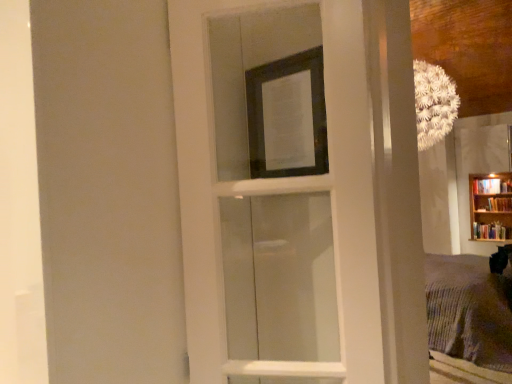
Describe the element at coordinates (490, 206) in the screenshot. I see `wooden bookcase at right` at that location.

This screenshot has width=512, height=384. I want to click on white glass door at center, so click(x=316, y=191).

Find the location of a particular element. This screenshot has height=384, width=512. transparent glass screen door at upper center is located at coordinates (108, 192).

This screenshot has width=512, height=384. I want to click on screen door that is under the matte black picture frame at upper center (from a real-world perspective), so click(108, 192).

From the image's perspective, who appears lower, transparent glass screen door at upper center or matte black picture frame at upper center?

transparent glass screen door at upper center is shown below in the image.

Based on the photo, does transparent glass screen door at upper center turn towards matte black picture frame at upper center?

No, transparent glass screen door at upper center is not facing towards matte black picture frame at upper center.

Which object is more forward, transparent glass screen door at upper center or matte black picture frame at upper center?

transparent glass screen door at upper center is closer to the camera.

At what (x,y) coordinates should I click in order to perform the action: click on door located above the wooden bookcase at right (from the image's perspective). Please return your answer as a coordinate pair (x, y). This screenshot has width=512, height=384. Looking at the image, I should click on (316, 191).

Is wooden bookcase at right facing away from white glass door at center?

Yes, wooden bookcase at right is facing away from white glass door at center.

In the scene shown: Does wooden bookcase at right touch white glass door at center?

No, wooden bookcase at right is not making contact with white glass door at center.

Is matte black picture frame at upper center taller or shorter than transparent glass screen door at upper center?

matte black picture frame at upper center is shorter than transparent glass screen door at upper center.

Based on the photo, from the image's perspective, between matte black picture frame at upper center and transparent glass screen door at upper center, who is located below?

transparent glass screen door at upper center, from the image's perspective.

Who is more distant, matte black picture frame at upper center or transparent glass screen door at upper center?

Positioned behind is matte black picture frame at upper center.

Consider the image. From a real-world perspective, which is physically above, matte black picture frame at upper center or transparent glass screen door at upper center?

matte black picture frame at upper center is physically above.

Is transparent glass screen door at upper center far from white glass door at center?

transparent glass screen door at upper center is near white glass door at center, not far away.

Measure the distance between transparent glass screen door at upper center and white glass door at center.

The distance of transparent glass screen door at upper center from white glass door at center is 30.57 centimeters.

Who is shorter, transparent glass screen door at upper center or white glass door at center?

white glass door at center is shorter.

Between point (71, 312) and point (341, 47), which one is positioned behind?

Positioned behind is point (341, 47).

Considering the relative sizes of white glass door at center and wooden bookcase at right in the image provided, is white glass door at center taller than wooden bookcase at right?

Yes.

Between point (401, 200) and point (495, 240), which one is positioned behind?

Positioned behind is point (495, 240).

Based on the photo, from a real-world perspective, is white glass door at center above or below wooden bookcase at right?

From a real-world perspective, white glass door at center is physically above wooden bookcase at right.

Who is shorter, wooden bookcase at right or transparent glass screen door at upper center?

Standing shorter between the two is wooden bookcase at right.

How many degrees apart are the facing directions of wooden bookcase at right and transparent glass screen door at upper center?

They differ by 177 degrees in their facing directions.

Is wooden bookcase at right not near transparent glass screen door at upper center?

Yes, wooden bookcase at right and transparent glass screen door at upper center are quite far apart.

From a real-world perspective, is wooden bookcase at right beneath transparent glass screen door at upper center?

Yes, from a real-world perspective, wooden bookcase at right is under transparent glass screen door at upper center.

Is transparent glass screen door at upper center shorter than wooden bookcase at right?

Incorrect, the height of transparent glass screen door at upper center does not fall short of that of wooden bookcase at right.

Considering the relative sizes of transparent glass screen door at upper center and wooden bookcase at right in the image provided, is transparent glass screen door at upper center smaller than wooden bookcase at right?

Actually, transparent glass screen door at upper center might be larger than wooden bookcase at right.

From the image's perspective, is transparent glass screen door at upper center located above wooden bookcase at right?

Indeed, from the image's perspective, transparent glass screen door at upper center is shown above wooden bookcase at right.

Is transparent glass screen door at upper center positioned in front of wooden bookcase at right?

Yes, the depth of transparent glass screen door at upper center is less than that of wooden bookcase at right.

The image size is (512, 384). In order to click on screen door below the matte black picture frame at upper center (from a real-world perspective) in this screenshot , I will do `click(108, 192)`.

You are a GUI agent. You are given a task and a screenshot of the screen. Output one action in this format:
    pyautogui.click(x=<x>, y=<y>)
    Task: Click on the door in front of the wooden bookcase at right
    This screenshot has height=384, width=512.
    Given the screenshot: What is the action you would take?
    pyautogui.click(x=316, y=191)

Which object lies further to the anchor point matte black picture frame at upper center, transparent glass screen door at upper center or wooden bookcase at right?

Among the two, wooden bookcase at right is located further to matte black picture frame at upper center.

When comparing their distances from white glass door at center, does wooden bookcase at right or transparent glass screen door at upper center seem further?

wooden bookcase at right lies further to white glass door at center than the other object.

From the picture: When comparing their distances from transparent glass screen door at upper center, does white glass door at center or matte black picture frame at upper center seem further?

matte black picture frame at upper center.

When comparing their distances from wooden bookcase at right, does matte black picture frame at upper center or white glass door at center seem closer?

white glass door at center is positioned closer to the anchor wooden bookcase at right.

Estimate the real-world distances between objects in this image. Which object is further from white glass door at center, matte black picture frame at upper center or wooden bookcase at right?

wooden bookcase at right lies further to white glass door at center than the other object.

When comparing their distances from white glass door at center, does matte black picture frame at upper center or transparent glass screen door at upper center seem closer?

The object closer to white glass door at center is matte black picture frame at upper center.

From the image, which object appears to be farther from transparent glass screen door at upper center, wooden bookcase at right or white glass door at center?

wooden bookcase at right lies further to transparent glass screen door at upper center than the other object.

Considering their positions, is transparent glass screen door at upper center positioned closer to white glass door at center than wooden bookcase at right?

transparent glass screen door at upper center is closer to white glass door at center.

Locate an element on the screen. door between transparent glass screen door at upper center and matte black picture frame at upper center from left to right is located at coordinates (316, 191).

Find the location of `picture frame located between transparent glass screen door at upper center and wooden bookcase at right in the depth direction`. picture frame located between transparent glass screen door at upper center and wooden bookcase at right in the depth direction is located at coordinates (286, 115).

Locate an element on the screen. picture frame between white glass door at center and wooden bookcase at right along the z-axis is located at coordinates (286, 115).

This screenshot has height=384, width=512. What are the coordinates of `door between transparent glass screen door at upper center and wooden bookcase at right from front to back` in the screenshot? It's located at (316, 191).